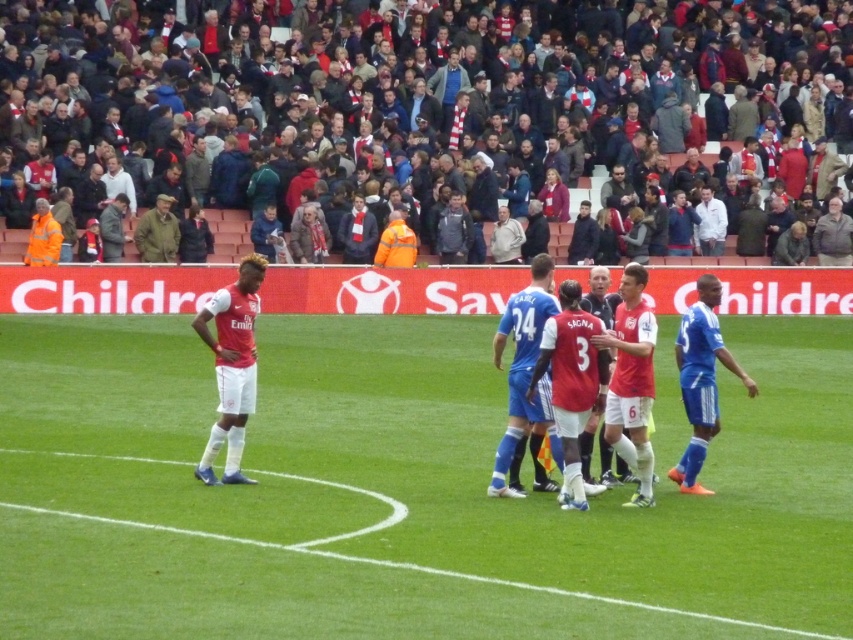
You are a photographer at the stadium and want to capture a photo of the blue jersey at center and the blue synthetic soccer player at right. Which one should you zoom in on to ensure the subject fills the frame better?

The blue jersey at center has a larger width than the blue synthetic soccer player at right, so zooming in on the blue jersey at center would make it fill the frame better.

Looking at this image, you are a referee in a football match and need to determine the position of two points on the field. The first point is marked as point (579, 305) and the second as point (142, 257). Based on the image, which point is closer to the front of the field?

Point (579, 305) is in front of point 0.168, so the first point is closer to the front of the field.